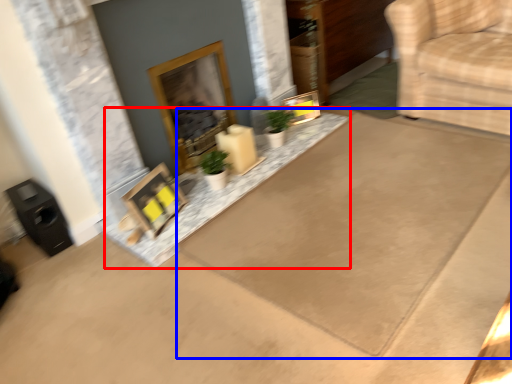
Question: Which object is closer to the camera taking this photo, concrete (highlighted by a red box) or doormat (highlighted by a blue box)?

Choices:
 (A) concrete
 (B) doormat

Answer: (B)